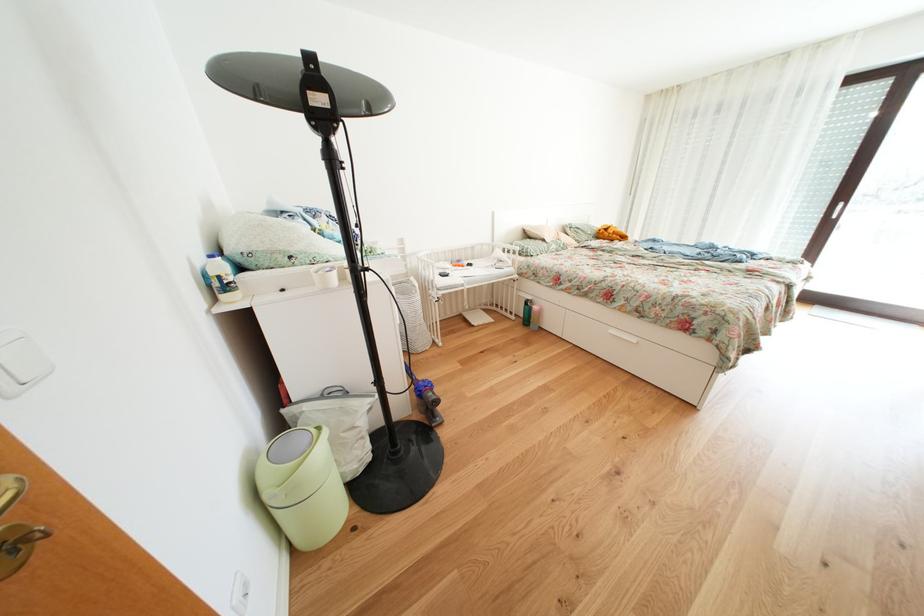
This screenshot has height=616, width=924. What are the coordinates of `trash can lid` in the screenshot? It's located at (295, 466).